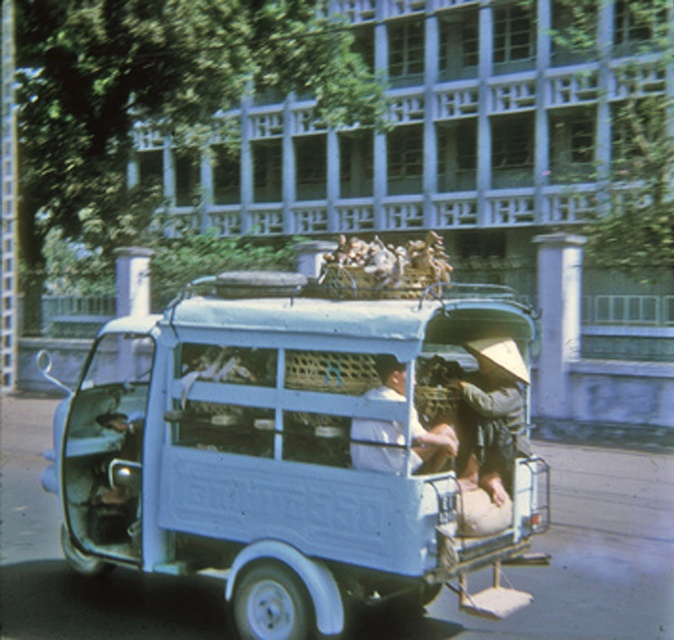
You are a delivery driver who needs to load a package into the light blue matte van at center. The package is 10 cm thick. Can you fit it into the van? Please explain your reasoning based on the van and the light blue fabric shirt at center.

The light blue matte van at center is thinner than the light blue fabric shirt at center. However, the thickness of the shirt does not provide information about the van. Therefore, it is unclear if the package will fit. More information is needed.

You are a passenger in the light blue matte van at center and need to exit the vehicle. Is the light blue fabric shirt at center blocking your way out?

The light blue matte van at center is to the right of the light blue fabric shirt at center, meaning the shirt is not blocking the exit path. You can exit safely.

You are standing next to the light blue matte van at center and want to hand a package to the person wearing the light blue fabric shirt at center. Can you reach them without moving from your current position?

The distance between the light blue matte van at center and the light blue fabric shirt at center is 1.31 meters. Since the average human arm span is about 1 meter, you would not be able to reach them without moving closer.